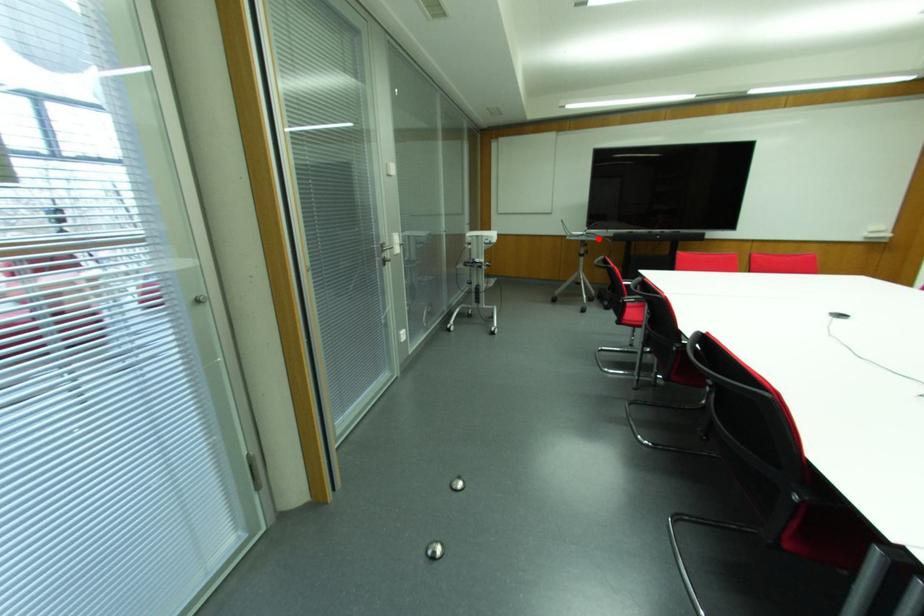
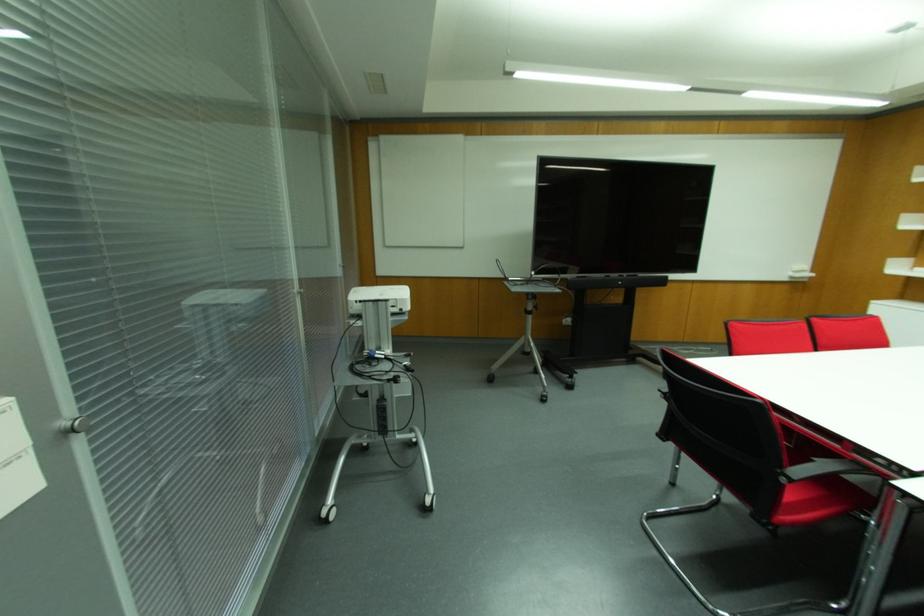
Question: I am providing you with two images of the same scene from different viewpoints. A red point is marked on the first image. Is the red point's position out of view in image 2?

Choices:
 (A) Yes
 (B) No

Answer: (B)